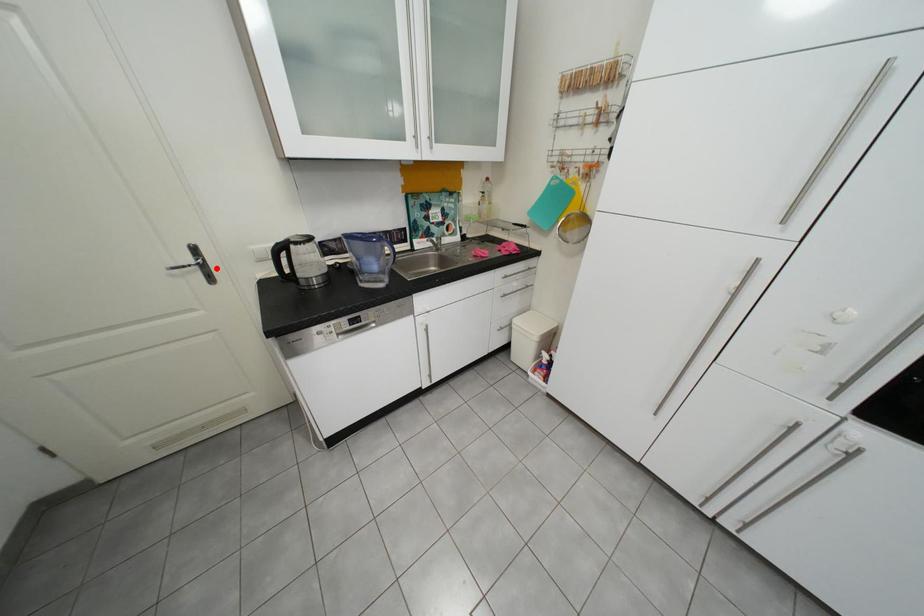
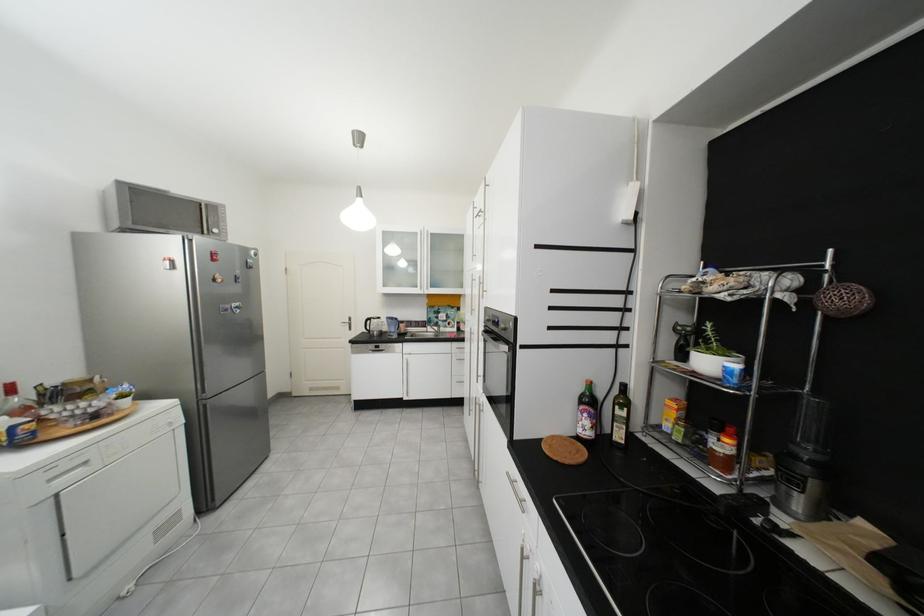
Question: A red point is marked in image1. In image2, is the corresponding 3D point closer to the camera or farther? Reply with the corresponding letter.

Choices:
 (A) The corresponding 3D point is closer.
 (B) The corresponding 3D point is farther.

Answer: (B)